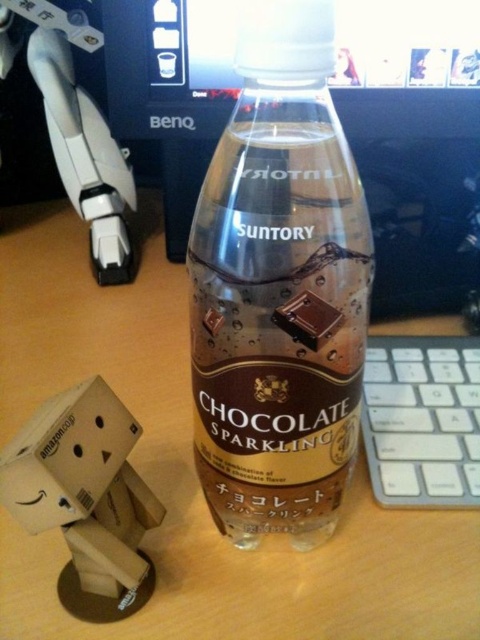
Question: Does brown matte plastic bottle at center have a greater width compared to white plastic keyboard at right?

Choices:
 (A) yes
 (B) no

Answer: (B)

Question: Which object is the closest to the white plastic keyboard at right?

Choices:
 (A) wooden figure at lower left
 (B) cardboard box at lower left
 (C) brown matte plastic bottle at center

Answer: (C)

Question: Which of the following is the farthest from the observer?

Choices:
 (A) chocolate matte at bottle center
 (B) white plastic keyboard at right
 (C) wooden figure at lower left

Answer: (B)

Question: Can you confirm if wooden figure at lower left is wider than white plastic keyboard at right?

Choices:
 (A) no
 (B) yes

Answer: (B)

Question: Is brown matte plastic bottle at center thinner than chocolate matte at bottle center?

Choices:
 (A) no
 (B) yes

Answer: (A)

Question: Which object is the farthest from the white plastic keyboard at right?

Choices:
 (A) cardboard box at lower left
 (B) chocolate matte at bottle center
 (C) brown matte plastic bottle at center
 (D) wooden figure at lower left

Answer: (A)